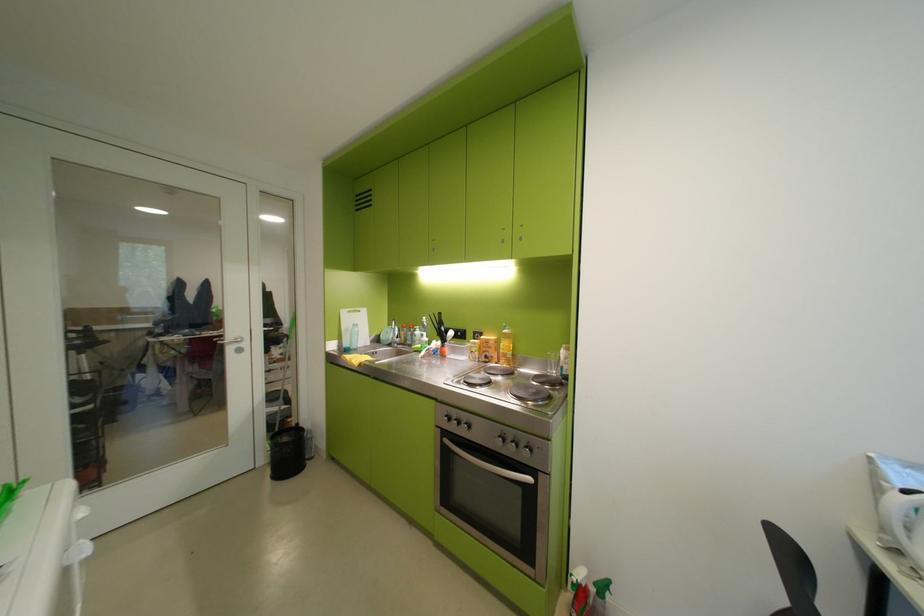
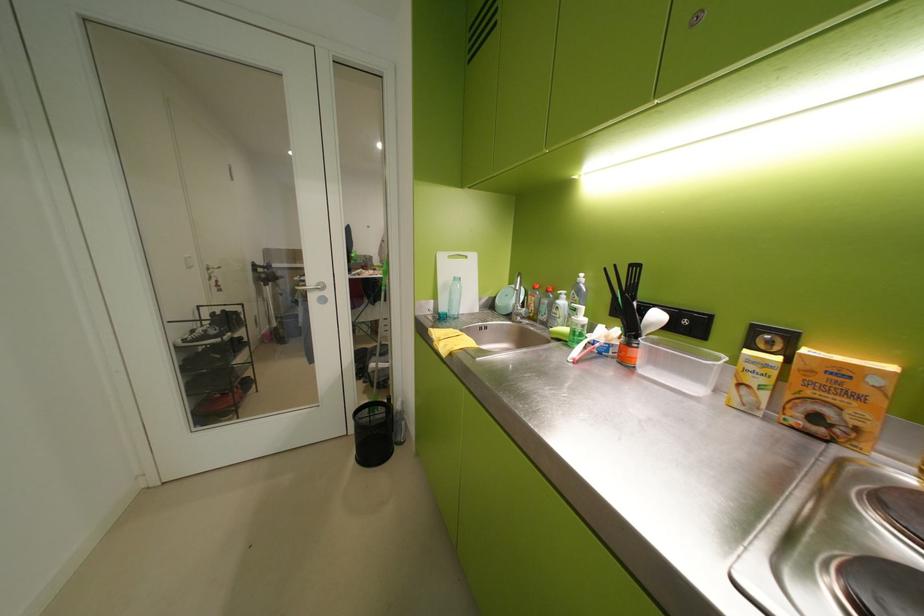
Where in the second image is the point corresponding to point (456, 350) from the first image?

(650, 354)